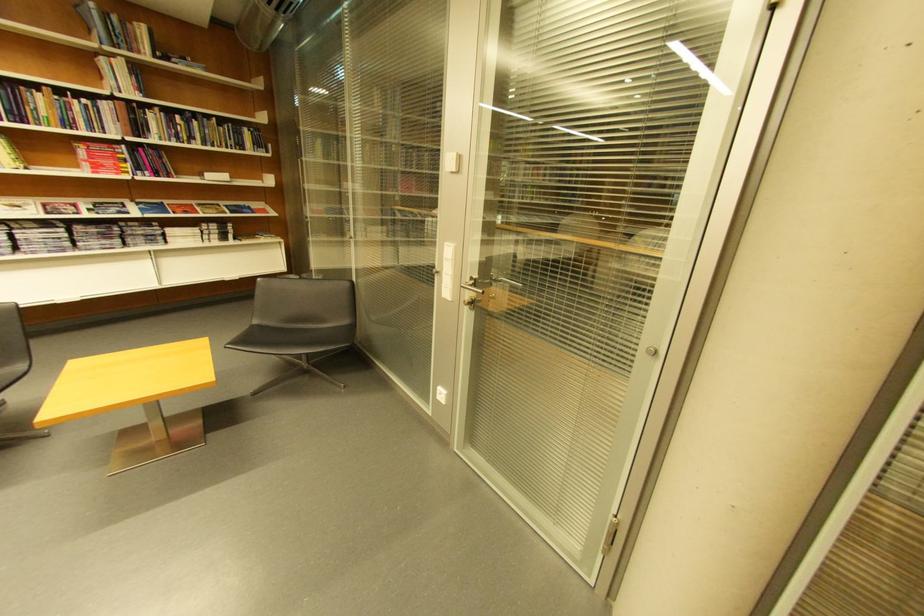
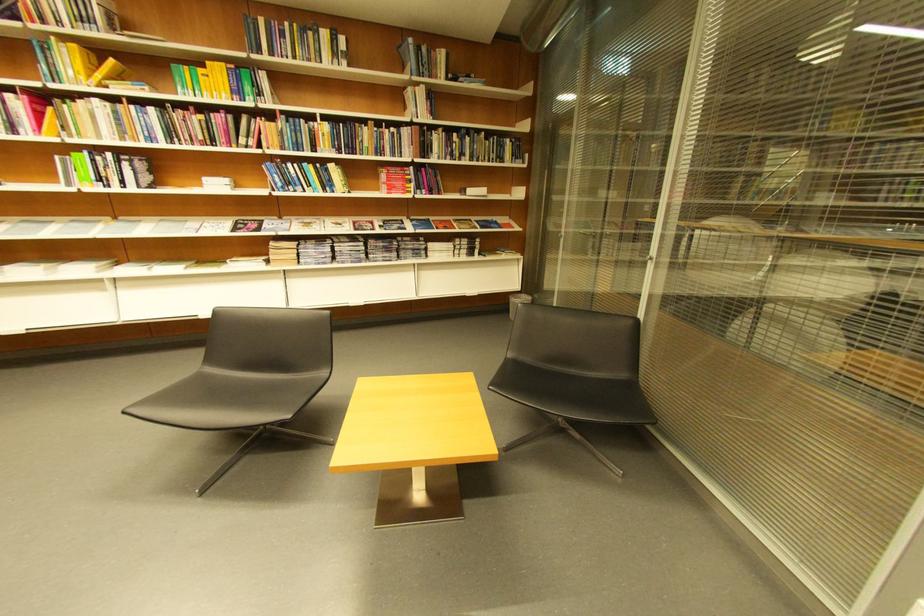
Where in the second image is the point corresponding to [105,148] from the first image?

(403, 172)